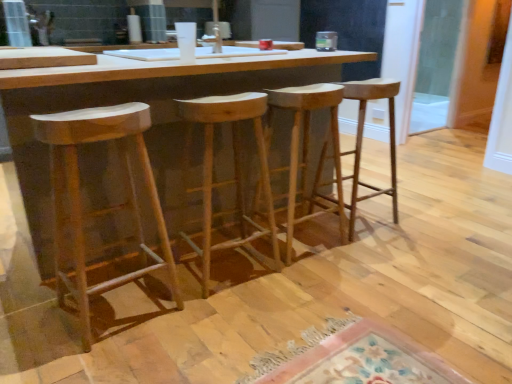
At what (x,y) coordinates should I click in order to perform the action: click on vacant space to the right of natural wood stool at center, which appears as the 3th stool when viewed from the right. Please return your answer as a coordinate pair (x, y). The height and width of the screenshot is (384, 512). Looking at the image, I should click on (304, 282).